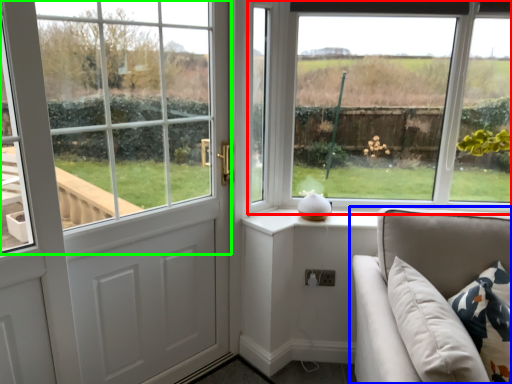
Question: Which is farther away from window (highlighted by a red box)? studio couch (highlighted by a blue box) or window (highlighted by a green box)?

Choices:
 (A) studio couch
 (B) window

Answer: (A)